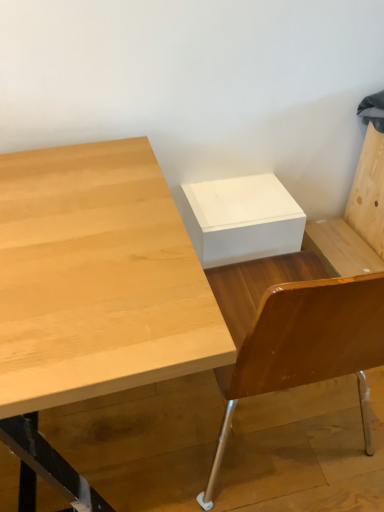
I want to click on blank space situated above white matte box at center (from a real-world perspective), so tap(233, 194).